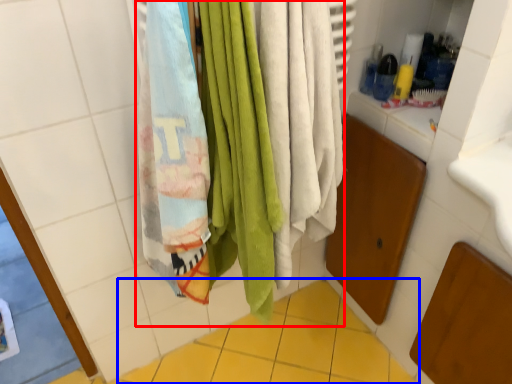
Question: Which object appears farthest to the camera in this image, beach towel (highlighted by a red box) or ceramic tile (highlighted by a blue box)?

Choices:
 (A) beach towel
 (B) ceramic tile

Answer: (B)